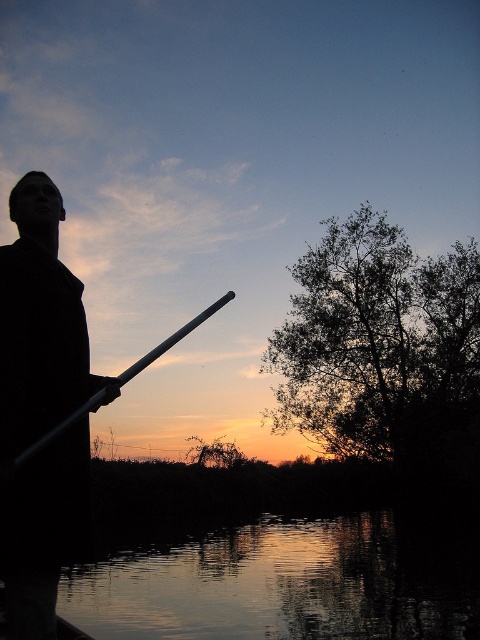
You are a photographer trying to capture the reflection of the sky in the silvery reflective water at lower center and the black matte coat at left. Which object will show a clearer reflection of the sky?

The silvery reflective water at lower center will show a clearer reflection of the sky because it has a greater height compared to the black matte coat at left.

You are a photographer trying to capture the reflection of the metallic silver paddle at center in the silvery reflective water at lower center. Based on the scene description, can you determine if the paddle is close enough to its reflection to be captured clearly in one frame?

The silvery reflective water at lower center and metallic silver paddle at center are 19.10 meters apart. Since the distance between them is quite large, the reflection of the paddle may not be close enough to be captured clearly in one frame.

You are an artist planning to paint the scene. You need to decide which object to detail first based on their size. Which object should you focus on first, the silvery reflective water at lower center or the black matte coat at left?

The silvery reflective water at lower center has a larger size compared to the black matte coat at left, so you should focus on detailing the silvery reflective water at lower center first because it occupies more space in the scene.